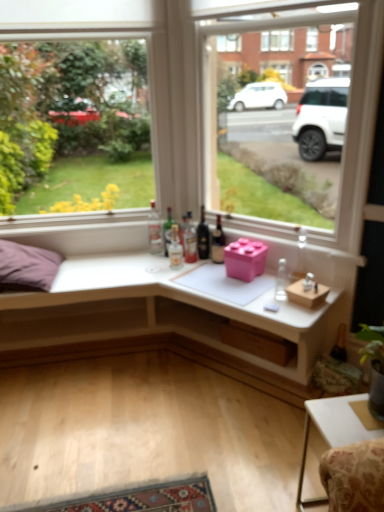
Image resolution: width=384 pixels, height=512 pixels. I want to click on free space to the back side of wooden box at right, the 2th window box in the bottom-to-top sequence, so click(273, 284).